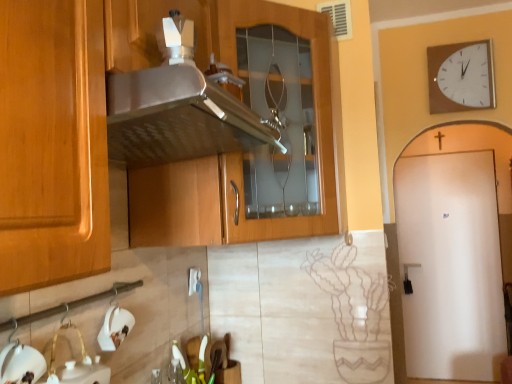
Question: Looking at their shapes, would you say white matte sink at lower left is wider or thinner than satin wood cabinet at center?

Choices:
 (A) wide
 (B) thin

Answer: (B)

Question: Which is correct: white matte sink at lower left is inside satin wood cabinet at center, or outside of it?

Choices:
 (A) inside
 (B) outside

Answer: (B)

Question: Which of these objects is positioned closest to the white matte sink at lower left?

Choices:
 (A) satin wood cabinet at center
 (B) white glossy sink at lower left
 (C) white matte door at right
 (D) white wooden wall clock at upper right

Answer: (B)

Question: Which of these objects is positioned farthest from the white matte sink at lower left?

Choices:
 (A) satin wood cabinet at center
 (B) white wooden wall clock at upper right
 (C) white glossy sink at lower left
 (D) white matte door at right

Answer: (D)